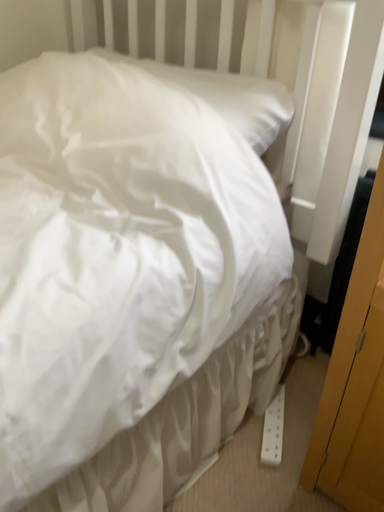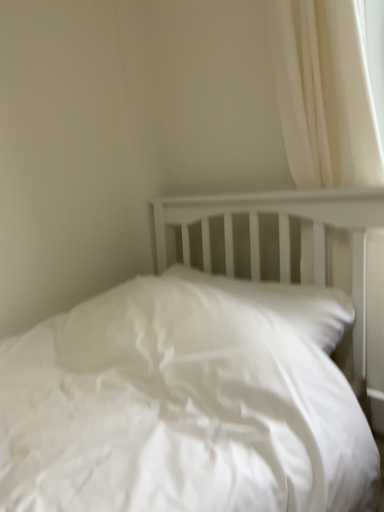
Question: How did the camera likely rotate when shooting the video?

Choices:
 (A) rotated upward
 (B) rotated downward

Answer: (A)